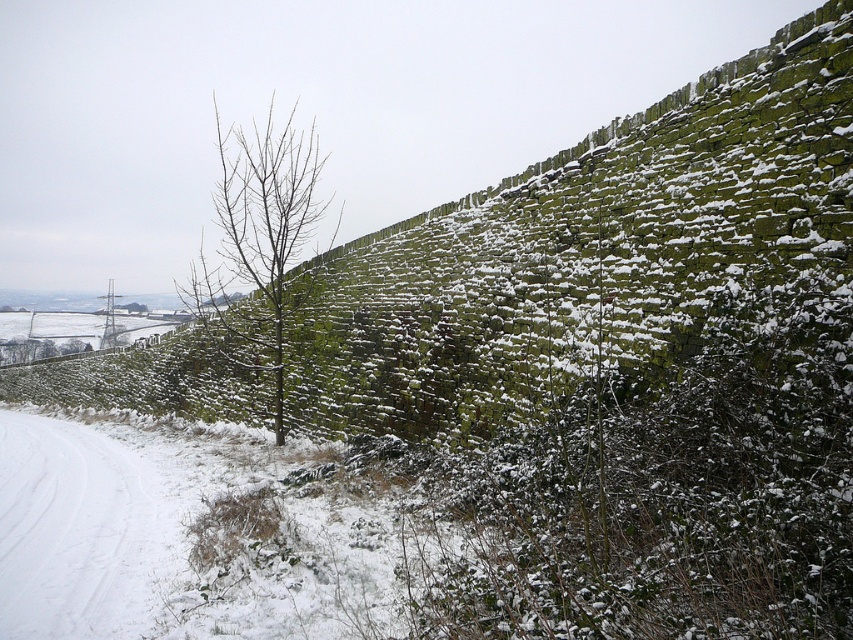
Who is higher up, green mossy hedge at center or bare branches at center?

Positioned higher is bare branches at center.

Does green mossy hedge at center have a lesser height compared to bare branches at center?

Indeed, green mossy hedge at center has a lesser height compared to bare branches at center.

Does point (741, 584) come behind point (294, 227)?

No, it is in front of (294, 227).

Where is `green mossy hedge at center`? This screenshot has height=640, width=853. green mossy hedge at center is located at coordinates (668, 493).

Image resolution: width=853 pixels, height=640 pixels. What do you see at coordinates (78, 532) in the screenshot?
I see `white snow at lower left` at bounding box center [78, 532].

Who is lower down, white snow at lower left or bare branches at center?

white snow at lower left is lower down.

Between point (59, 435) and point (279, 392), which one is positioned behind?

Positioned behind is point (59, 435).

Identify the location of white snow at lower left. The height and width of the screenshot is (640, 853). (78, 532).

Can you confirm if green mossy hedge at center is positioned above white snow at lower left?

Yes, green mossy hedge at center is above white snow at lower left.

The height and width of the screenshot is (640, 853). What do you see at coordinates (668, 493) in the screenshot?
I see `green mossy hedge at center` at bounding box center [668, 493].

This screenshot has width=853, height=640. What do you see at coordinates (668, 493) in the screenshot? I see `green mossy hedge at center` at bounding box center [668, 493].

Find the location of a particular element. This screenshot has width=853, height=640. green mossy hedge at center is located at coordinates (668, 493).